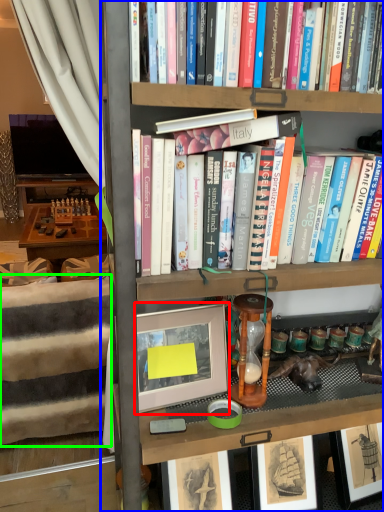
Question: Which is nearer to the picture frame (highlighted by a red box)? bookcase (highlighted by a blue box) or bed frame (highlighted by a green box).

Choices:
 (A) bookcase
 (B) bed frame

Answer: (A)